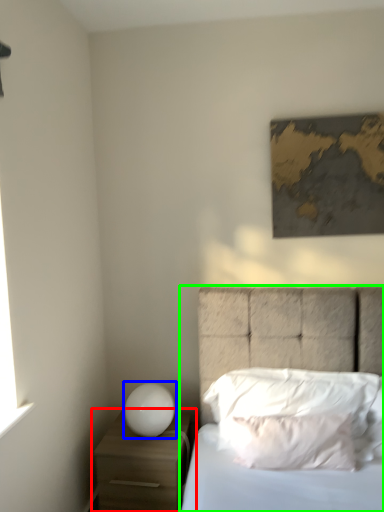
Question: Which is nearer to the nightstand (highlighted by a red box)? table lamp (highlighted by a blue box) or bed (highlighted by a green box).

Choices:
 (A) table lamp
 (B) bed

Answer: (A)